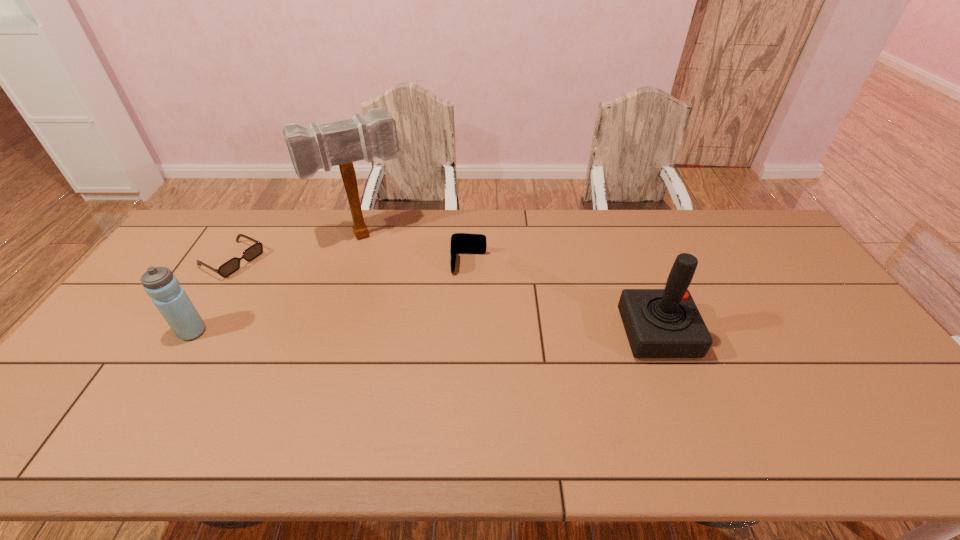
This screenshot has width=960, height=540. I want to click on vacant spot on the desktop that is between the third shortest object and the rightmost object and is positioned on the outer surface of the second object from right to left, so click(x=466, y=333).

Where is `vacant space on the desktop that is between the water bottle and the joystick and is positioned at the head of the third object from left to right`? vacant space on the desktop that is between the water bottle and the joystick and is positioned at the head of the third object from left to right is located at coordinates (410, 333).

Locate an element on the screen. free space on the desktop that is between the third shortest object and the joystick and is positioned on the front-facing side of the sunglasses is located at coordinates (370, 333).